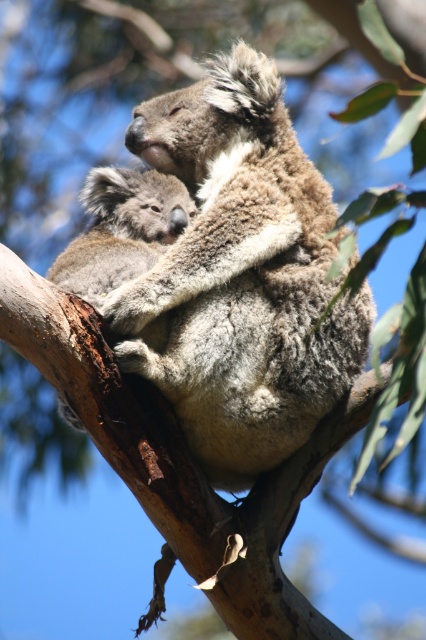
You are standing in a wildlife sanctuary and see the fuzzy brown koala at center. If you want to take a photo of it without disturbing the koalas, what is the minimum distance you should maintain?

The minimum distance you should maintain from the fuzzy brown koala at center is 16.84 feet to avoid disturbing it.

You are observing two koalas on a tree branch. The fuzzy brown koala at center and the fuzzy gray koala at center are both present. Which of the two has a greater width?

The fuzzy brown koala at center has a greater width than the fuzzy gray koala at center according to the description provided.

Where is the fuzzy brown koala at center located in the image?

The fuzzy brown koala at center is located at point (241,275).